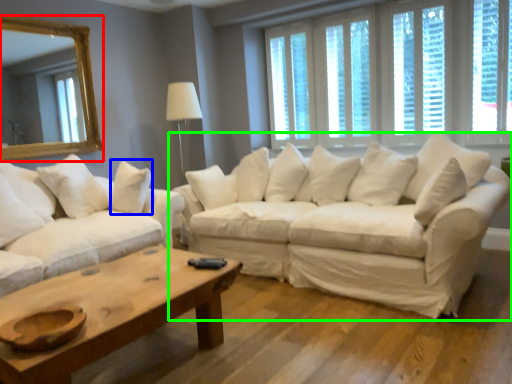
Question: Based on their relative distances, which object is nearer to mirror (highlighted by a red box)? Choose from pillow (highlighted by a blue box) and studio couch (highlighted by a green box).

Choices:
 (A) pillow
 (B) studio couch

Answer: (A)